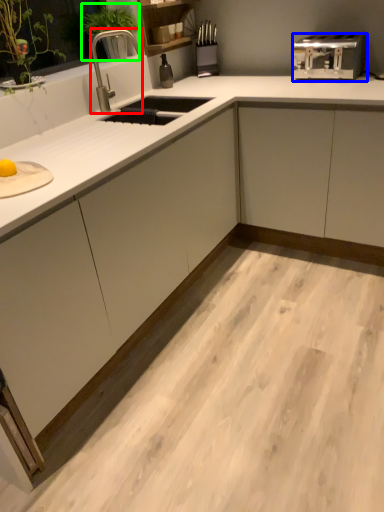
Question: Which is nearer to the faucet (highlighted by a red box)? toaster (highlighted by a blue box) or plant (highlighted by a green box).

Choices:
 (A) toaster
 (B) plant

Answer: (B)